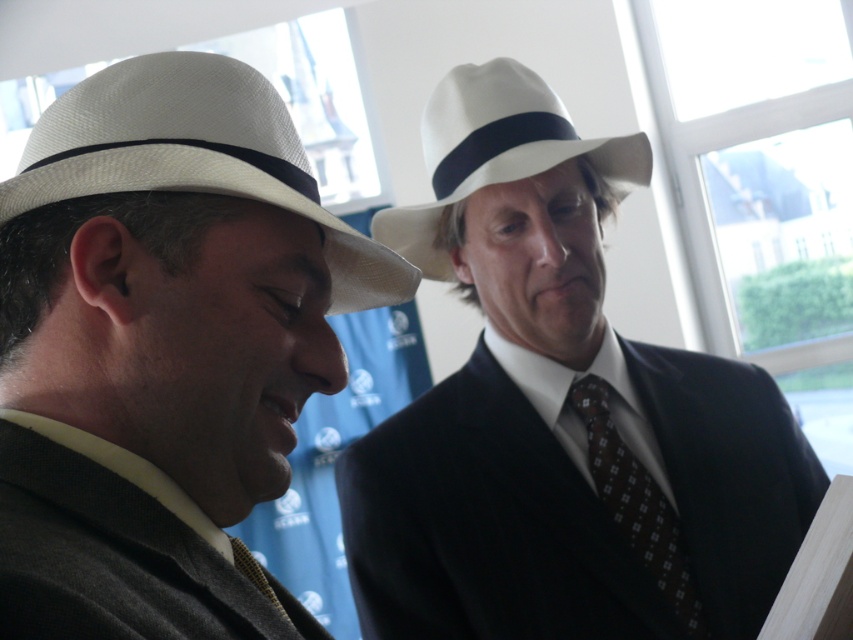
Based on the photo, you are an interior designer assessing the placement of two hats in a room. The white matte fedora at upper center and the white felt cowboy hat at upper center are both displayed on a shelf. Which hat has a larger width?

The white matte fedora at upper center has a larger width than the white felt cowboy hat at upper center according to the description.

You are a photographer setting up a camera to capture the two people in the scene. The camera has a focus range of 30 inches. Can you focus on both the matte white hat at left and the brown dotted fabric tie at right simultaneously?

The matte white hat at left is 32.65 inches from the brown dotted fabric tie at right, which exceeds the camera focus range of 30 inches. Therefore, you cannot focus on both simultaneously.